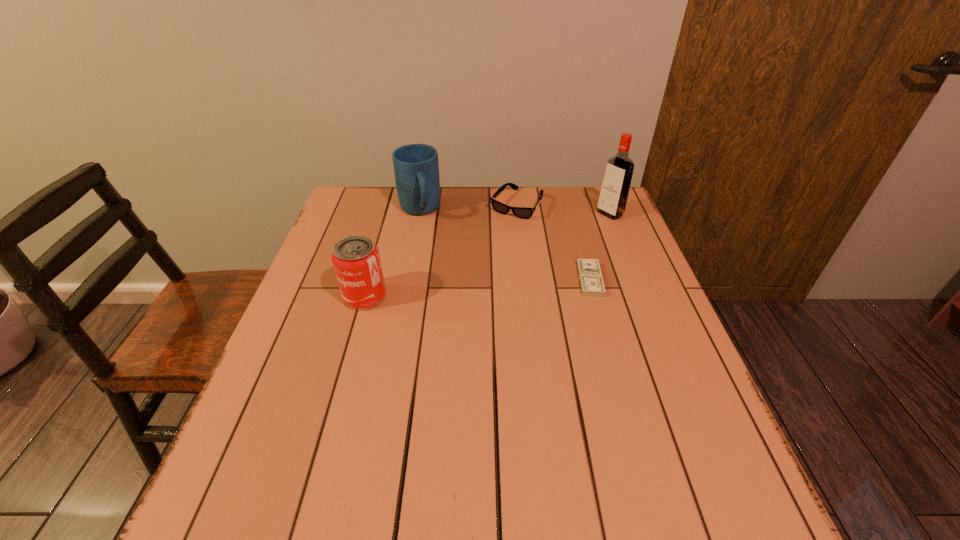
What are the coordinates of `vacant space located 0.300m on the front-facing side of the third object from right to left` in the screenshot? It's located at (465, 279).

Where is `free location located on the front-facing side of the third object from right to left`? This screenshot has width=960, height=540. free location located on the front-facing side of the third object from right to left is located at coordinates (476, 263).

At what (x,y) coordinates should I click in order to perform the action: click on vacant space located on the front-facing side of the third object from right to left. Please return your answer as a coordinate pair (x, y). Looking at the image, I should click on (458, 288).

The image size is (960, 540). In order to click on vacant space located on the front and back of the tallest object in this screenshot , I will do `click(579, 232)`.

Where is `vacant area situated on the front and back of the tallest object`? Image resolution: width=960 pixels, height=540 pixels. vacant area situated on the front and back of the tallest object is located at coordinates 574,235.

Find the location of a particular element. Image resolution: width=960 pixels, height=540 pixels. free region located 0.260m on the front and back of the tallest object is located at coordinates (544, 253).

Identify the location of vacant area located on the side of the second tallest object with the handle. (441, 280).

Identify the location of blank space located on the side of the second tallest object with the handle. This screenshot has height=540, width=960. (426, 237).

Identify the location of vacant area located 0.400m on the side of the second tallest object with the handle. This screenshot has height=540, width=960. (455, 320).

Identify the location of sunglasses located at the far edge. tap(521, 212).